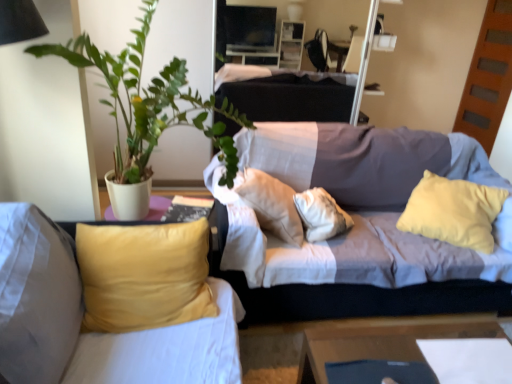
Question: Visually, is velvet yellow pillow at left, which ranks as the 2th studio couch in right-to-left order, positioned to the left or to the right of textured gray couch at center, the 1th studio couch from the right?

Choices:
 (A) left
 (B) right

Answer: (A)

Question: From the image's perspective, is velvet yellow pillow at left, the 1th studio couch positioned from the left, above or below textured gray couch at center, the 1th studio couch from the right?

Choices:
 (A) above
 (B) below

Answer: (B)

Question: Estimate the real-world distances between objects in this image. Which object is closer to the textured gray couch at center, which is counted as the 2th studio couch, starting from the left?

Choices:
 (A) green leafy plant at upper left
 (B) wooden table at lower right
 (C) velvet yellow pillow at left, which ranks as the 2th studio couch in right-to-left order

Answer: (B)

Question: Which object is the closest to the wooden table at lower right?

Choices:
 (A) green leafy plant at upper left
 (B) velvet yellow pillow at left, which ranks as the 2th studio couch in right-to-left order
 (C) textured gray couch at center, which is counted as the 2th studio couch, starting from the left

Answer: (C)